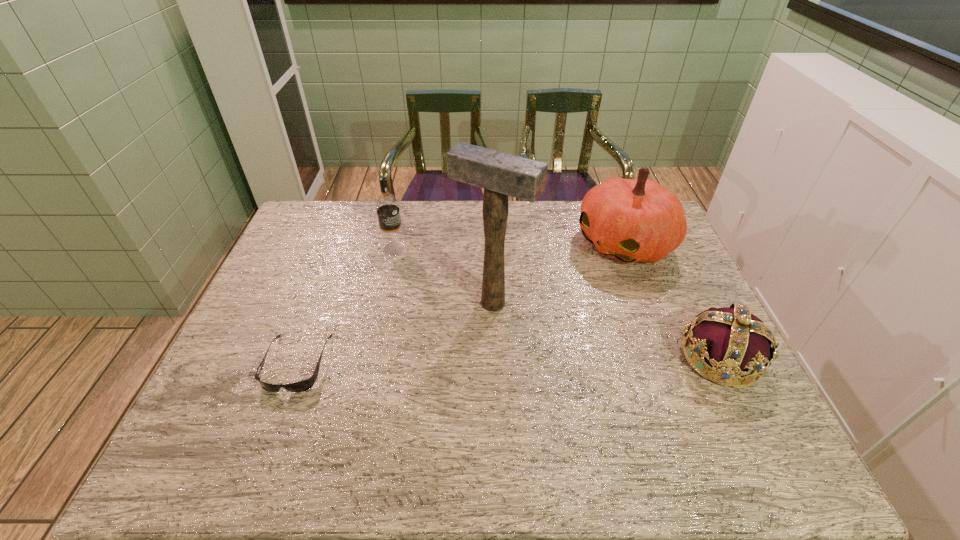
This screenshot has width=960, height=540. I want to click on free space at the left edge, so click(x=254, y=307).

This screenshot has width=960, height=540. Find the location of `vacant area at the right edge of the desktop`. vacant area at the right edge of the desktop is located at coordinates (745, 390).

Identify the location of vacant point at the far left corner. The width and height of the screenshot is (960, 540). (300, 226).

You are a GUI agent. You are given a task and a screenshot of the screen. Output one action in this format:
    pyautogui.click(x=<x>, y=<y>)
    Task: Click on the vacant space at the near left corner
    
    Given the screenshot: What is the action you would take?
    pyautogui.click(x=256, y=399)

Where is `empty space between the shortest object and the crown`? empty space between the shortest object and the crown is located at coordinates (509, 360).

Locate an element on the screen. free area in between the second object from left to right and the fourth tallest object is located at coordinates [558, 303].

The width and height of the screenshot is (960, 540). Identify the location of free spot between the leftmost object and the pumpkin. (461, 303).

I want to click on empty space between the crown and the pumpkin, so click(673, 301).

Find the location of a particular element. The height and width of the screenshot is (540, 960). empty location between the vodka and the crown is located at coordinates (558, 303).

Where is `free space between the second object from left to right and the leftmost object`? The image size is (960, 540). free space between the second object from left to right and the leftmost object is located at coordinates (346, 306).